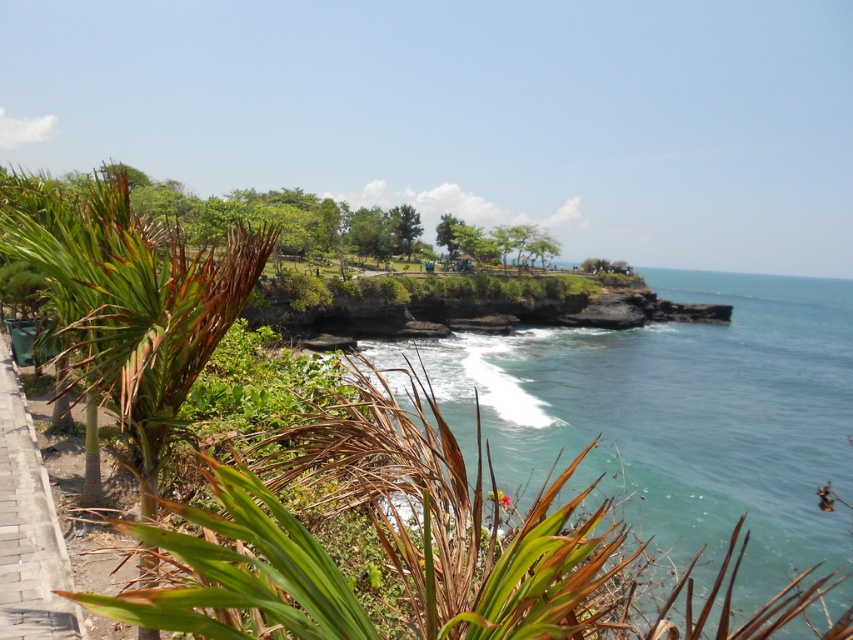
Is clear blue water at center closer to camera compared to green leafy palm tree at left?

No.

Who is higher up, clear blue water at center or green leafy palm tree at left?

green leafy palm tree at left

At what (x,y) coordinates should I click in order to perform the action: click on clear blue water at center. Please return your answer as a coordinate pair (x, y). The image size is (853, 640). Looking at the image, I should click on pos(675,419).

Between green leafy palm tree at left and brick paved path at lower left, which one appears on the left side from the viewer's perspective?

green leafy palm tree at left is more to the left.

Is green leafy palm tree at left closer to camera compared to brick paved path at lower left?

Yes, green leafy palm tree at left is in front of brick paved path at lower left.

The height and width of the screenshot is (640, 853). What are the coordinates of `green leafy palm tree at left` in the screenshot? It's located at (132, 301).

Find the location of a particular element. green leafy palm tree at left is located at coordinates (132, 301).

Between clear blue water at center and brick paved path at lower left, which one is positioned higher?

clear blue water at center is higher up.

Who is more forward, (722, 353) or (19, 620)?

Point (19, 620) is in front.

Locate an element on the screen. This screenshot has height=640, width=853. clear blue water at center is located at coordinates (675, 419).